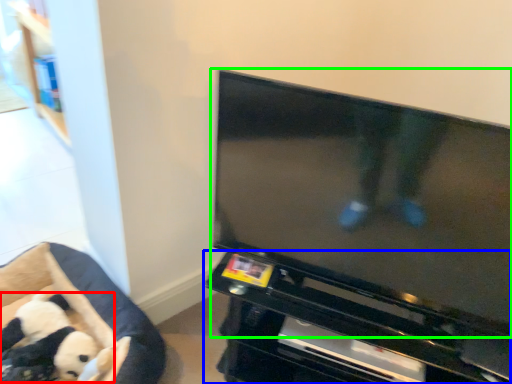
Question: Considering the real-world distances, which object is closest to toy (highlighted by a red box)? entertainment center (highlighted by a blue box) or television (highlighted by a green box).

Choices:
 (A) entertainment center
 (B) television

Answer: (A)